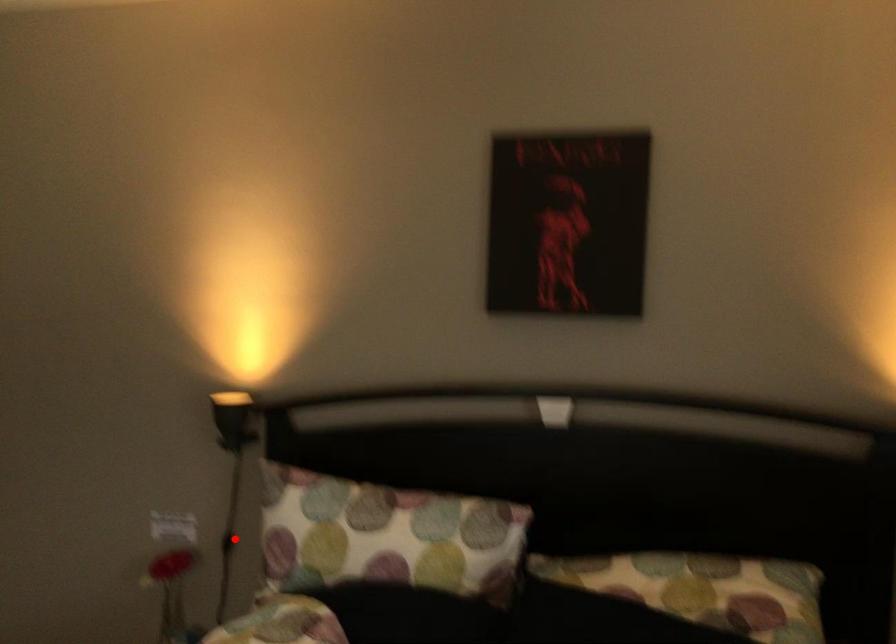
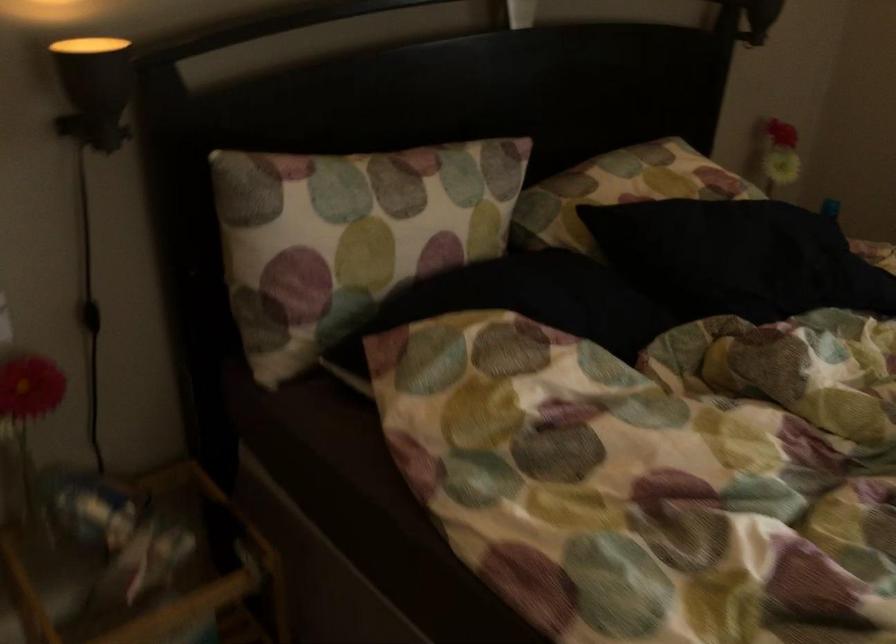
Question: I am providing you with two images of the same scene from different viewpoints. In image1, a red point is highlighted. Considering the same 3D point in image2, which of the following is correct?

Choices:
 (A) It is closer
 (B) It is farther

Answer: (A)